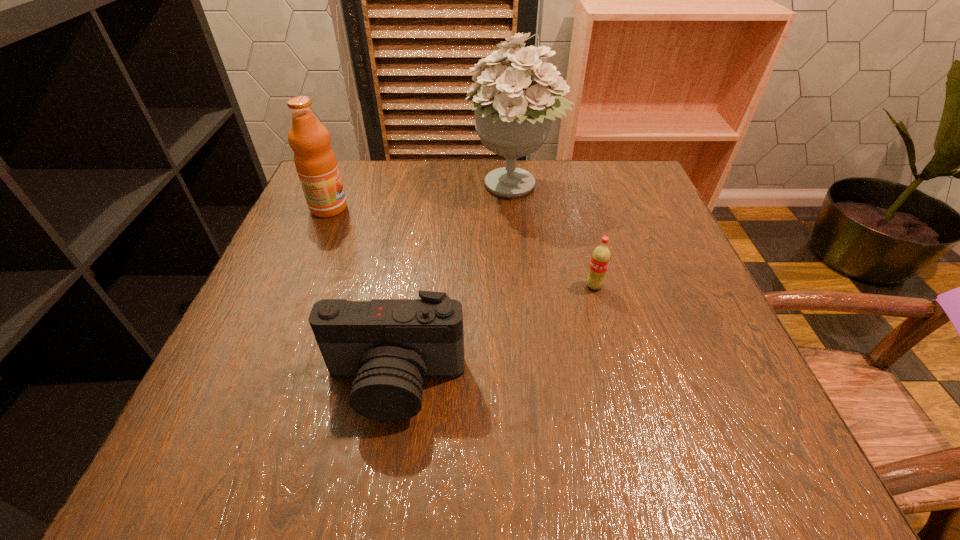
You are a GUI agent. You are given a task and a screenshot of the screen. Output one action in this format:
    pyautogui.click(x=<x>, y=<y>)
    Task: Click on the tallest object
    The width and height of the screenshot is (960, 540).
    Given the screenshot: What is the action you would take?
    [x=513, y=115]

Identify the location of the leftmost object. The image size is (960, 540). (316, 164).

The width and height of the screenshot is (960, 540). I want to click on the third shortest object, so (x=316, y=164).

I want to click on camera, so click(x=388, y=345).

Where is `the nearest object`? This screenshot has height=540, width=960. the nearest object is located at coordinates (388, 345).

Where is `the second nearest object`? the second nearest object is located at coordinates coord(600,259).

In order to click on soda in this screenshot , I will do `click(600, 259)`.

Where is `vacant space located on the left of the tallest object`? Image resolution: width=960 pixels, height=540 pixels. vacant space located on the left of the tallest object is located at coordinates (348, 186).

Where is `vacant space located on the label side of the leftmost object`? vacant space located on the label side of the leftmost object is located at coordinates (414, 208).

Locate an element on the screen. vacant space situated 0.200m on the back of the soda is located at coordinates (577, 219).